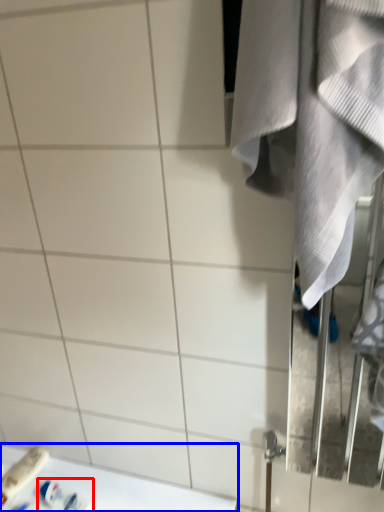
Question: Which of the following is the farthest to the observer, toiletry (highlighted by a red box) or counter top (highlighted by a blue box)?

Choices:
 (A) toiletry
 (B) counter top

Answer: (A)